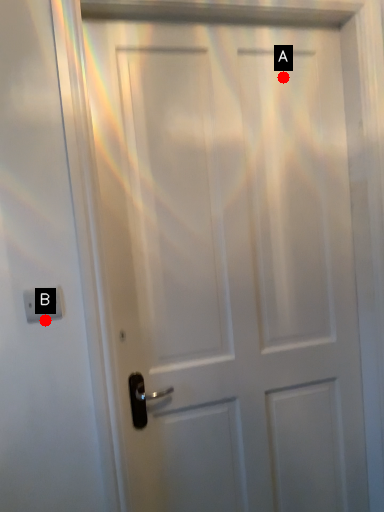
Question: Two points are circled on the image, labeled by A and B beside each circle. Which point appears farthest from the camera in this image?

Choices:
 (A) A is further
 (B) B is further

Answer: (A)